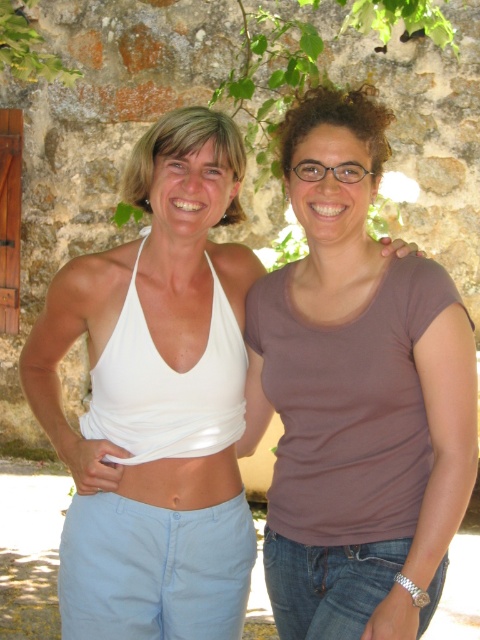
You are a photographer trying to capture both the brown matte shirt at center and the white fabric top at center in your shot. Since you want to ensure both are fully visible, which one should you focus on adjusting the camera angle for, considering their heights?

The brown matte shirt at center is much taller as white fabric top at center, so you should adjust the camera angle to accommodate the taller brown matte shirt at center to ensure both are fully visible.

You are a photographer trying to capture the perfect shot of the scene. You need to focus on the brown matte shirt at center. What are the coordinates where you should aim your camera?

The coordinates to focus on the brown matte shirt at center are point (357, 396).

You are a photographer trying to capture the two people in the image. Since the brown matte shirt at center and the white fabric top at center are both in the frame, can you tell me which one is positioned higher?

The brown matte shirt at center is above the white fabric top at center, so the brown matte shirt at center is positioned higher.